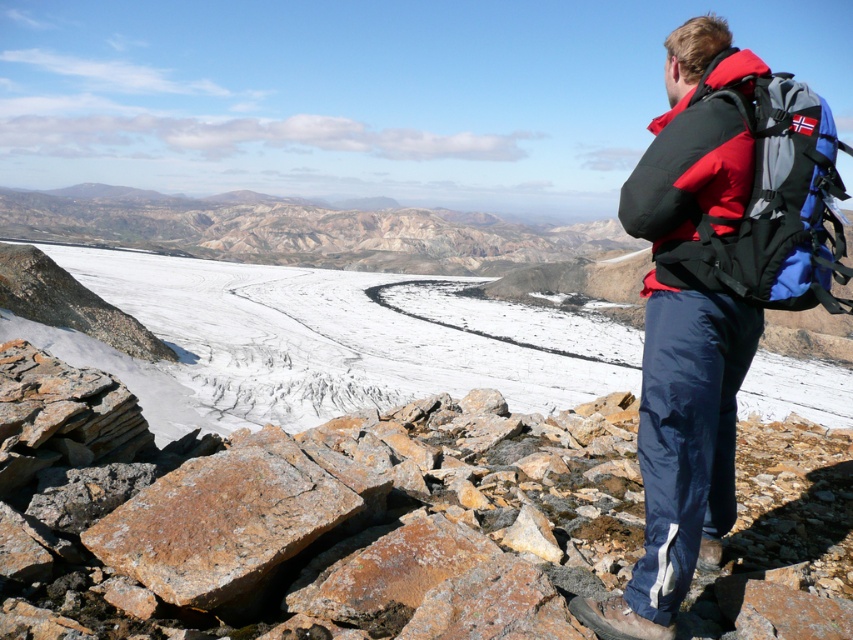
Question: Is rusty rock at lower left above blue fabric backpack at right?

Choices:
 (A) yes
 (B) no

Answer: (B)

Question: Which object appears closest to the camera in this image?

Choices:
 (A) rusty rock at lower left
 (B) blue fabric backpack at right

Answer: (B)

Question: Does rusty rock at lower left appear under matte black jacket at center?

Choices:
 (A) yes
 (B) no

Answer: (A)

Question: In this image, where is rusty rock at lower left located relative to blue fabric backpack at right?

Choices:
 (A) above
 (B) below

Answer: (B)

Question: Considering the real-world distances, which object is closest to the rusty rock at lower left?

Choices:
 (A) blue fabric backpack at right
 (B) matte black jacket at center

Answer: (B)

Question: Which object appears farthest from the camera in this image?

Choices:
 (A) matte black jacket at center
 (B) blue fabric backpack at right

Answer: (A)